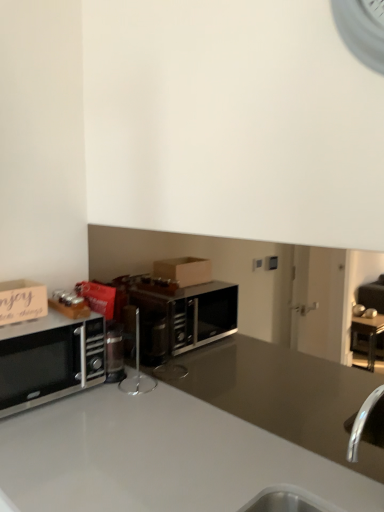
Question: Does point (x=23, y=283) appear closer or farther from the camera than point (x=142, y=389)?

Choices:
 (A) farther
 (B) closer

Answer: (A)

Question: In terms of width, does wooden sign at left look wider or thinner when compared to satin silver stand at center?

Choices:
 (A) wide
 (B) thin

Answer: (A)

Question: Considering the real-world distances, which object is farthest from the satin silver stand at center?

Choices:
 (A) satin black microwave at left
 (B) wooden sign at left

Answer: (B)

Question: Estimate the real-world distances between objects in this image. Which object is closer to the satin silver stand at center?

Choices:
 (A) wooden sign at left
 (B) satin black microwave at left

Answer: (B)